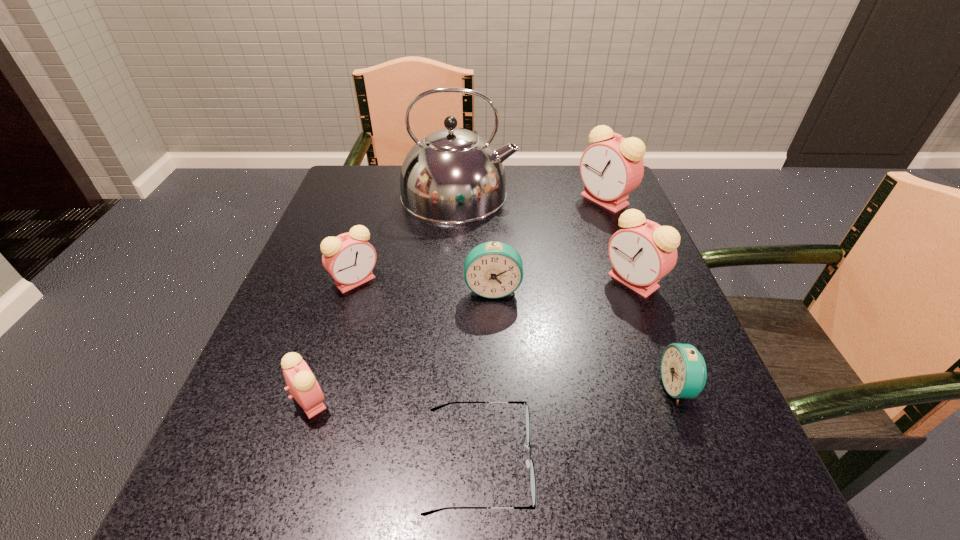
Where is `object located in the far right corner section of the desktop`? object located in the far right corner section of the desktop is located at coordinates (610, 169).

In the image, there is a desktop. Where is `vacant space at the far edge`? This screenshot has width=960, height=540. vacant space at the far edge is located at coordinates (504, 211).

This screenshot has width=960, height=540. In the image, there is a desktop. In order to click on vacant region at the near edge in this screenshot , I will do `click(341, 531)`.

Identify the location of free space at the left edge. (310, 365).

This screenshot has width=960, height=540. Find the location of `vacant area at the right edge`. vacant area at the right edge is located at coordinates (716, 400).

Locate an element on the screen. vacant space at the far left corner of the desktop is located at coordinates (375, 180).

The width and height of the screenshot is (960, 540). I want to click on vacant area between the sixth shortest object and the smaller blue alarm clock, so click(656, 334).

The width and height of the screenshot is (960, 540). I want to click on free spot between the spectacles and the third smallest pink alarm clock, so click(556, 372).

Where is `vacant point located between the third biggest pink alarm clock and the third alarm clock from left to right`? Image resolution: width=960 pixels, height=540 pixels. vacant point located between the third biggest pink alarm clock and the third alarm clock from left to right is located at coordinates (424, 285).

The image size is (960, 540). Identify the location of blank region between the right blue alarm clock and the sixth shortest object. (656, 334).